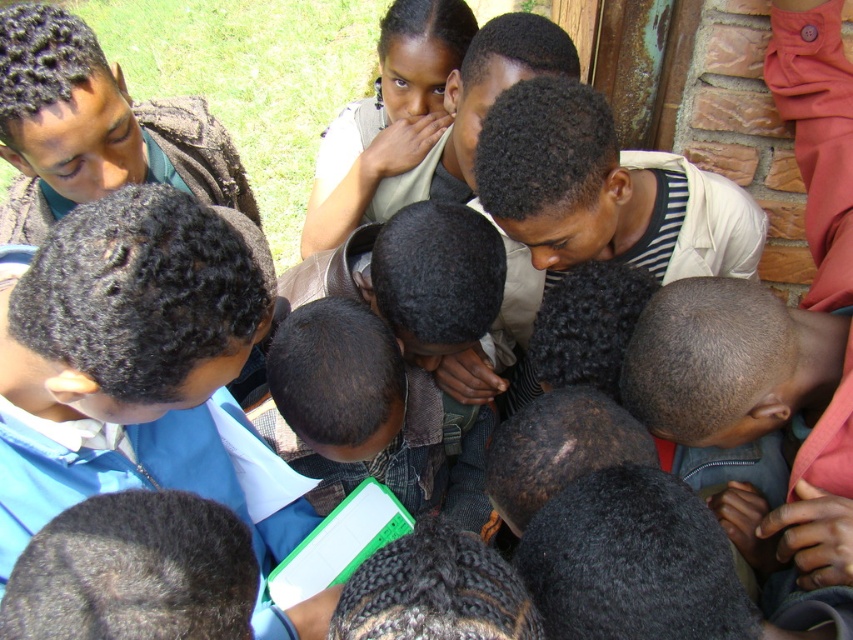
Is point (73, 461) more distant than point (350, 148)?

No, it is in front of (350, 148).

From the picture: Does blue fabric shirt at center lie in front of matte beige shirt at center?

Yes.

Describe the element at coordinates (125, 353) in the screenshot. I see `blue fabric shirt at center` at that location.

The height and width of the screenshot is (640, 853). What are the coordinates of `blue fabric shirt at center` in the screenshot? It's located at (125, 353).